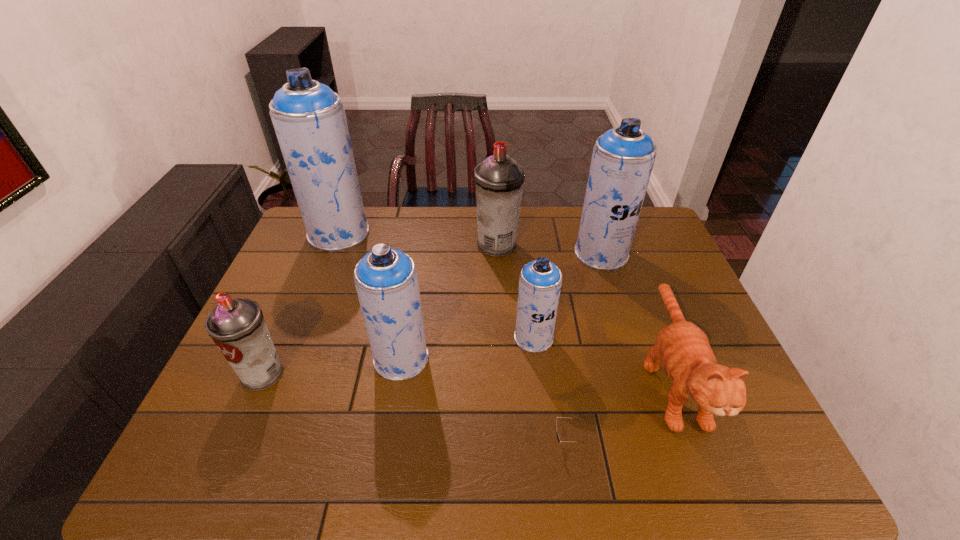
Where is `the nearer gray aerosol can`? the nearer gray aerosol can is located at coordinates (237, 326).

Image resolution: width=960 pixels, height=540 pixels. What are the coordinates of `cat` in the screenshot? It's located at (683, 349).

Identify the location of the seventh tallest object. This screenshot has width=960, height=540. (683, 349).

Identify the location of black sunglasses. (558, 438).

Locate an element on the screen. The image size is (960, 540). sunglasses is located at coordinates (558, 438).

You are a GUI agent. You are given a task and a screenshot of the screen. Output one action in this format:
    pyautogui.click(x=<x>, y=<y>)
    Task: Click on the vacant region located 0.360m on the right of the tallest object
    
    Given the screenshot: What is the action you would take?
    pyautogui.click(x=472, y=233)

This screenshot has width=960, height=540. Identify the location of vacant space located on the left of the seventh shortest object. (453, 253).

Find the location of `vacant space located on the front of the farther gray aerosol can`. vacant space located on the front of the farther gray aerosol can is located at coordinates (501, 321).

Identify the location of vacant space located 0.060m on the left of the third object from left to right. (350, 359).

Locate an element on the screen. vacant position located 0.140m on the front of the smallest blue aerosol can is located at coordinates (541, 400).